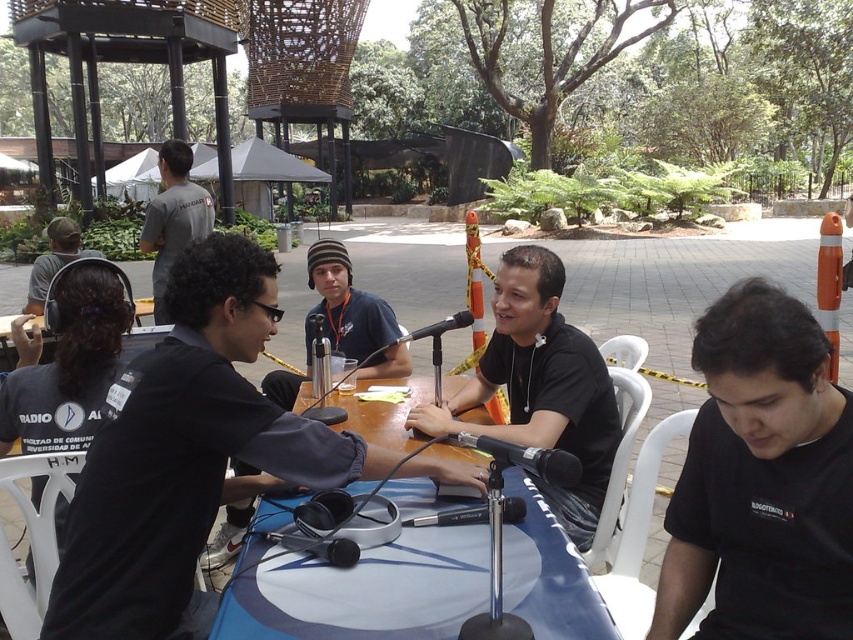
Which is more to the right, blue fabric table at center or black matte shirt at center?

black matte shirt at center

Can you confirm if blue fabric table at center is positioned below black matte shirt at center?

Yes, blue fabric table at center is below black matte shirt at center.

Is point (466, 460) positioned after point (573, 435)?

No, it is in front of (573, 435).

Where is `blue fabric table at center`? blue fabric table at center is located at coordinates tap(367, 593).

Is matte black headphones at left thinner than black matte microphone at center?

No.

Is point (94, 250) closer to camera compared to point (469, 312)?

That is False.

Image resolution: width=853 pixels, height=640 pixels. Find the location of `matte black headphones at left`. matte black headphones at left is located at coordinates (54, 260).

Does black matte headphones at center appear under dark blue knit beanie at center?

Yes.

Does black matte headphones at center have a lesser width compared to dark blue knit beanie at center?

No, black matte headphones at center is not thinner than dark blue knit beanie at center.

Between point (88, 561) and point (408, 369), which one is positioned behind?

Positioned behind is point (408, 369).

Where is `black matte headphones at center`? This screenshot has height=640, width=853. black matte headphones at center is located at coordinates click(186, 454).